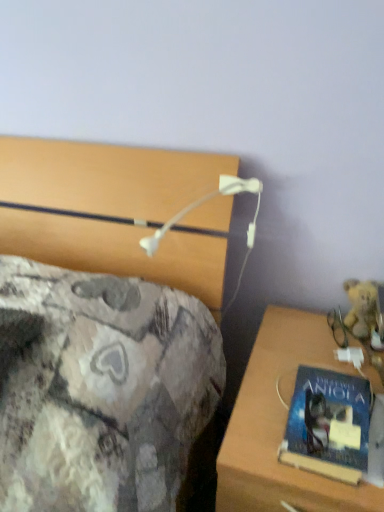
I want to click on free area behind blue matte book at right, so click(300, 359).